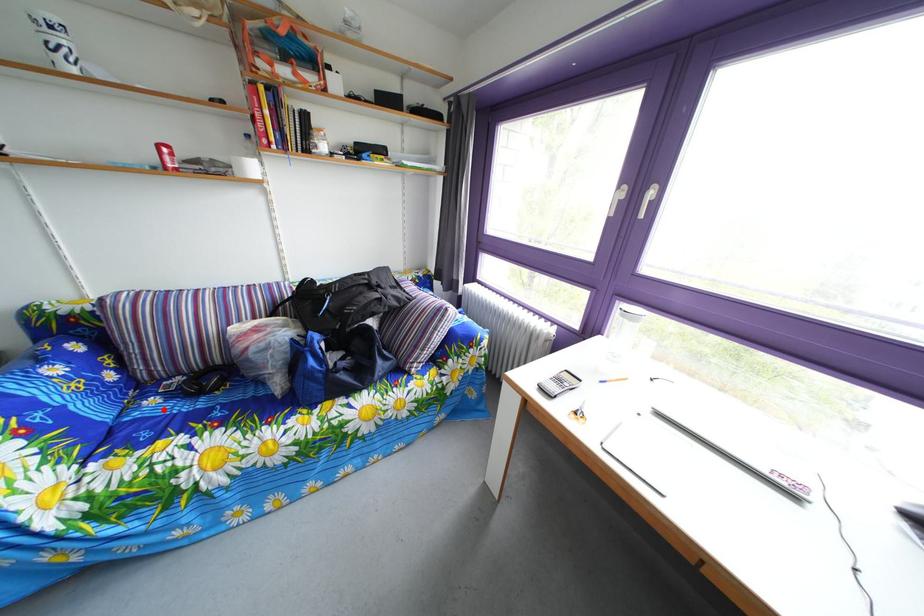
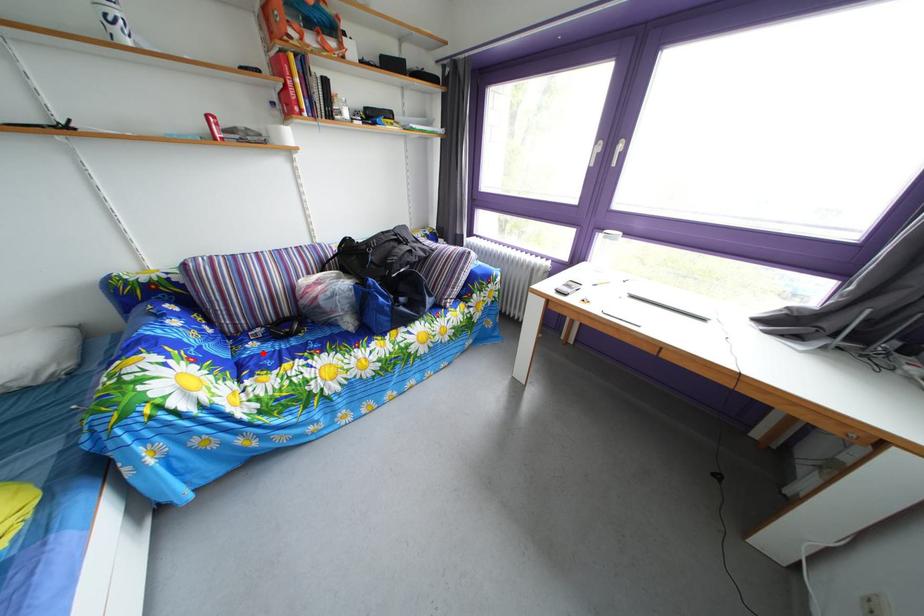
I am providing you with two images of the same scene from different viewpoints. A red point is marked on the first image and another point is marked on the second image. Does the point marked in image1 correspond to the same location as the one in image2?

Yes